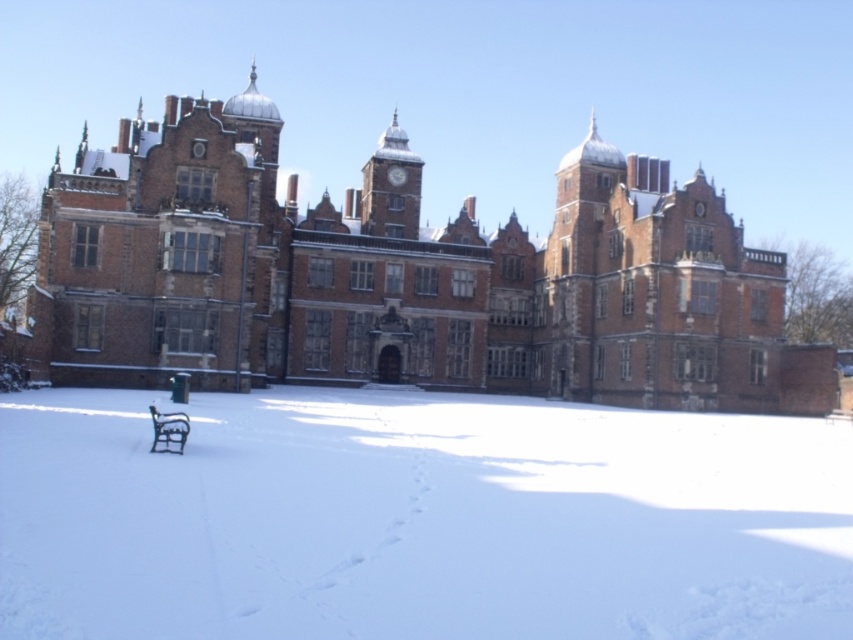
The width and height of the screenshot is (853, 640). Identify the location of white powdery snow at center. (418, 518).

Between white powdery snow at center and brown brick castle at center, which one has more height?

brown brick castle at center is taller.

Which is behind, point (467, 545) or point (364, 236)?

The point (364, 236) is more distant.

This screenshot has width=853, height=640. What are the coordinates of `white powdery snow at center` in the screenshot? It's located at (418, 518).

Does brown brick castle at center appear on the right side of black wrought iron bench at lower left?

Indeed, brown brick castle at center is positioned on the right side of black wrought iron bench at lower left.

What do you see at coordinates (402, 276) in the screenshot? I see `brown brick castle at center` at bounding box center [402, 276].

This screenshot has height=640, width=853. What are the coordinates of `brown brick castle at center` in the screenshot? It's located at (402, 276).

Where is `brown brick castle at center`? brown brick castle at center is located at coordinates (402, 276).

Does white powdery snow at center have a larger size compared to black wrought iron bench at lower left?

Indeed, white powdery snow at center has a larger size compared to black wrought iron bench at lower left.

Does point (264, 488) lie behind point (154, 444)?

That is False.

At what (x,y) coordinates should I click in order to perform the action: click on white powdery snow at center. Please return your answer as a coordinate pair (x, y). Looking at the image, I should click on (418, 518).